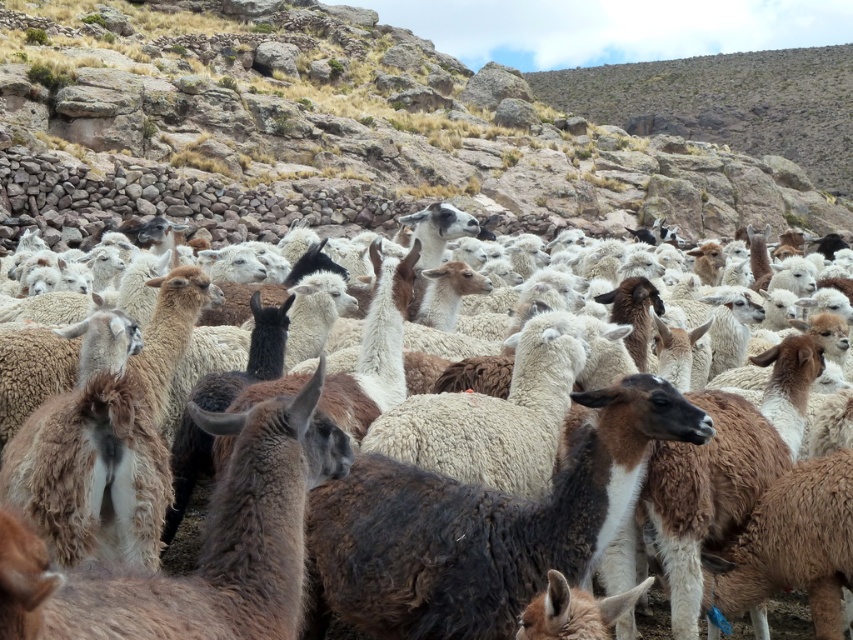
Does brown woolen alpacas at center have a greater width compared to fuzzy white sheep at center?

Yes.

Is brown woolen alpacas at center smaller than fuzzy white sheep at center?

Actually, brown woolen alpacas at center might be larger than fuzzy white sheep at center.

Is point (746, 68) closer to camera compared to point (80, 392)?

That is False.

Identify the location of brown woolen alpacas at center. This screenshot has height=640, width=853. (404, 124).